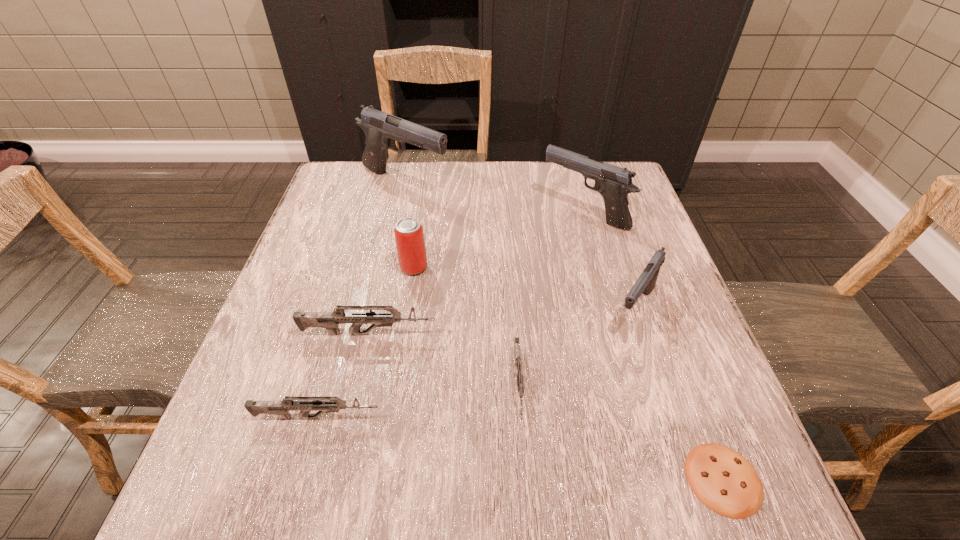
The height and width of the screenshot is (540, 960). Identify the location of free space located on the right of the sixth nearest object. (480, 267).

You are a GUI agent. You are given a task and a screenshot of the screen. Output one action in this format:
    pyautogui.click(x=<x>, y=<y>)
    Task: Click on the vacant area situated at the muzzle of the nearest black gun
    
    Given the screenshot: What is the action you would take?
    pyautogui.click(x=701, y=508)

Where is `free spot located aimed along the barrel of the fifth tallest object`? The height and width of the screenshot is (540, 960). free spot located aimed along the barrel of the fifth tallest object is located at coordinates (626, 334).

I want to click on vacant space positioned 0.160m aimed along the barrel of the sixth tallest object, so click(474, 417).

This screenshot has height=540, width=960. I want to click on vacant position located 0.130m aimed along the barrel of the shortest gun, so click(527, 510).

Where is `free location located on the back of the shortest object`? The height and width of the screenshot is (540, 960). free location located on the back of the shortest object is located at coordinates (677, 357).

The image size is (960, 540). In order to click on object located in the near edge section of the desktop in this screenshot , I will do `click(726, 482)`.

Identify the location of cookie that is positioned at the right edge. (726, 482).

Identify the location of object that is at the far left corner. Image resolution: width=960 pixels, height=540 pixels. (381, 129).

Where is `object at the far right corner`? The image size is (960, 540). object at the far right corner is located at coordinates (614, 183).